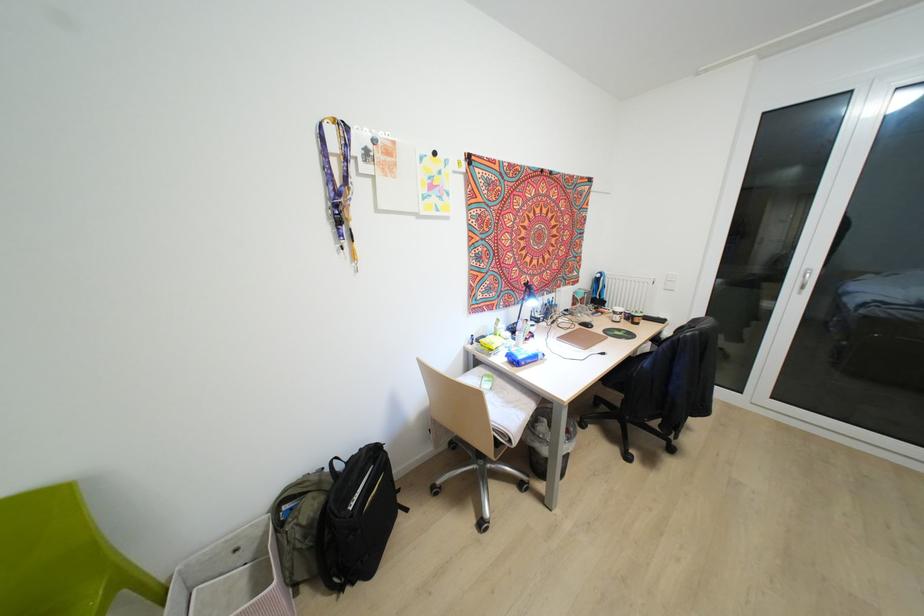
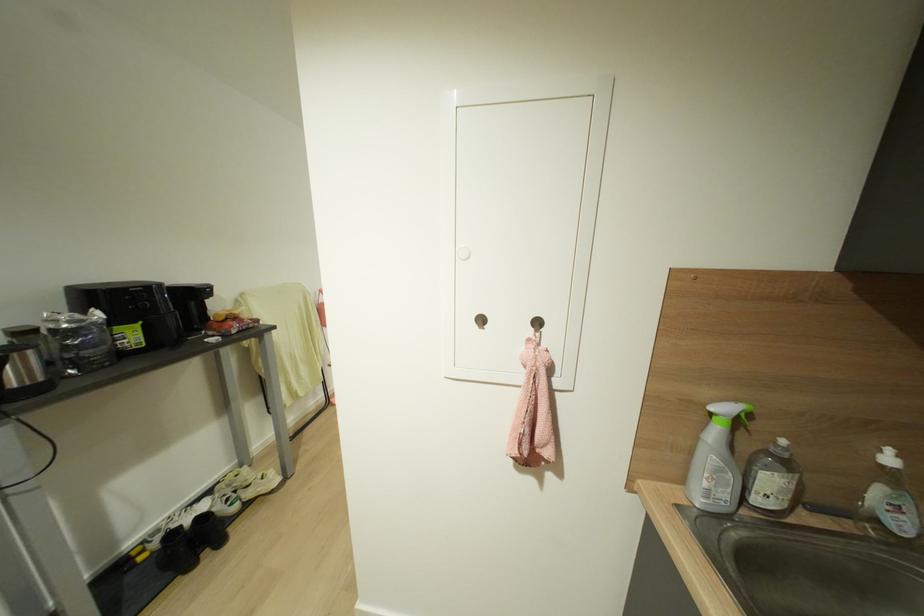
Question: I am providing you with two images of the same scene from different viewpoints. Which of the following objects are not visible in image2?

Choices:
 (A) pink storage bin
 (B) metal ring handle
 (C) soap dispenser pump
 (D) white cabinet knob

Answer: (A)